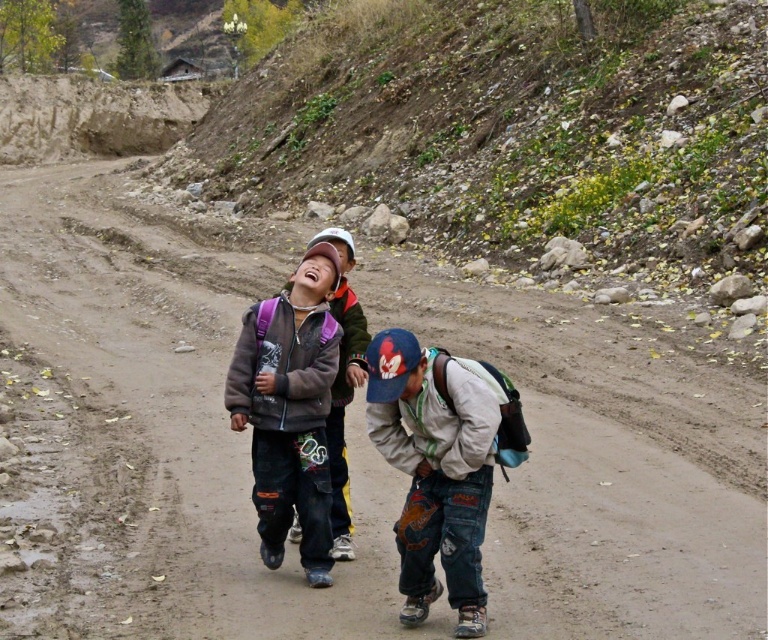
Who is lower down, matte gray jacket at center or matte blue backpack at center?

matte gray jacket at center is below.

Can you confirm if matte gray jacket at center is bigger than matte blue backpack at center?

Yes.

Identify the location of matte gray jacket at center. (290, 410).

The image size is (768, 640). I want to click on matte gray jacket at center, so click(x=290, y=410).

Who is positioned more to the left, denim pants at center or matte gray jacket at center?

matte gray jacket at center is more to the left.

Who is more distant from viewer, [409,429] or [303,272]?

Point [303,272]

The image size is (768, 640). What do you see at coordinates (435, 470) in the screenshot? I see `denim pants at center` at bounding box center [435, 470].

Locate an element on the screen. denim pants at center is located at coordinates coord(435,470).

Is denim pants at center positioned before matte blue backpack at center?

Yes, it is in front of matte blue backpack at center.

Looking at this image, does denim pants at center appear over matte blue backpack at center?

Actually, denim pants at center is below matte blue backpack at center.

Where is `denim pants at center`? The image size is (768, 640). denim pants at center is located at coordinates (435, 470).

Locate an element on the screen. The image size is (768, 640). denim pants at center is located at coordinates (435, 470).